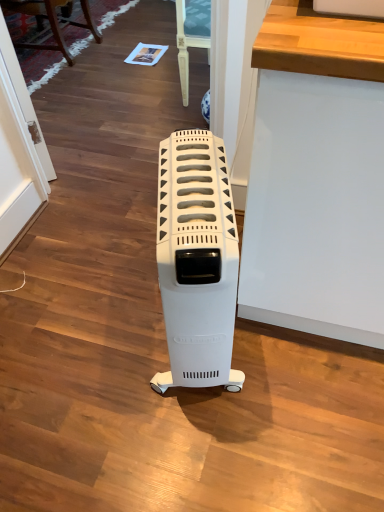
Identify the location of vacant area to the right of white plastic heater at center. The height and width of the screenshot is (512, 384). point(291,366).